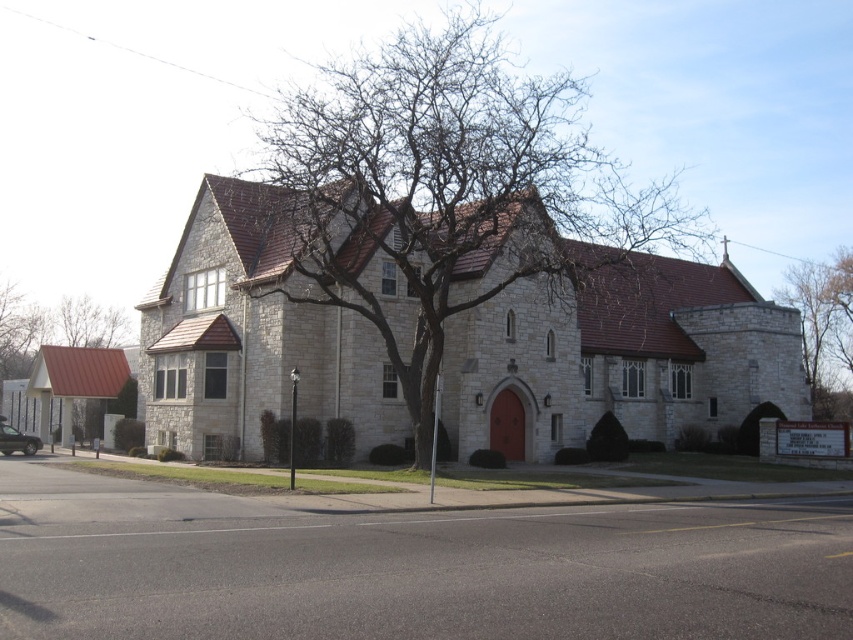
Is point (834, 328) in front of point (109, 346)?

Yes, point (834, 328) is in front of point (109, 346).

Locate an element on the screen. The height and width of the screenshot is (640, 853). bare stone tree at upper right is located at coordinates (824, 328).

Is bare branches at center shorter than brown textured roof at upper left?

Incorrect, bare branches at center's height does not fall short of brown textured roof at upper left's.

Is bare branches at center above brown textured roof at upper left?

Correct, bare branches at center is located above brown textured roof at upper left.

Image resolution: width=853 pixels, height=640 pixels. Describe the element at coordinates (445, 192) in the screenshot. I see `bare branches at center` at that location.

I want to click on bare branches at center, so click(445, 192).

Is point (405, 124) closer to camera compared to point (775, 298)?

That is True.

In the scene shown: Is the position of bare branches at center less distant than that of bare stone tree at upper right?

Yes, bare branches at center is closer to the viewer.

Is point (271, 176) positioned in front of point (849, 292)?

That is False.

The image size is (853, 640). Identify the location of bare branches at center. (445, 192).